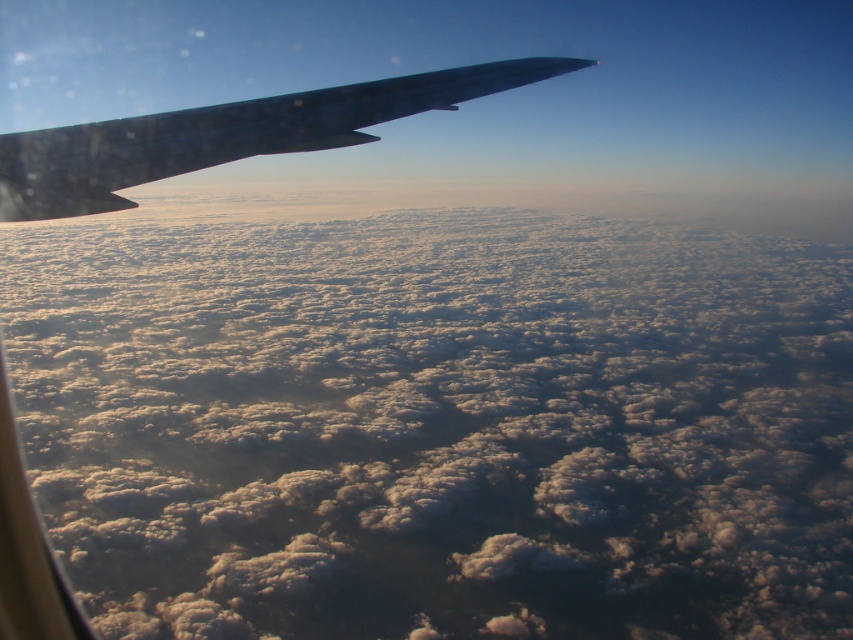
You are a pilot looking out the aircraft window and see the point marked at coordinates (436, 424). What object is located at that point?

The point at coordinates (436, 424) corresponds to a white fluffy cloud at upper center.

You are a pilot observing the clouds from the aircraft window. There are two points marked on your screen at coordinates point (772, 246) and point (387, 109). Which point is closer to the aircraft wing visible in the foreground?

Point (387, 109) is closer to the aircraft wing in the foreground because it is in front of point (772, 246), which is further away from the wing.

You are a pilot observing the view from the cockpit window. You notice the white fluffy cloud at upper center and the glossy metallic wing at upper left. Which object appears bigger in the scene?

The white fluffy cloud at upper center appears bigger than the glossy metallic wing at upper left because it has a larger size compared to the wing.